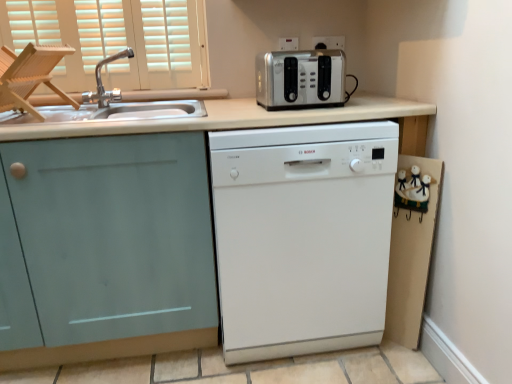
Question: Considering the relative positions of silver metallic outlet at upper center, which ranks as the 1th electric outlet in left-to-right order, and wooden folding chair at left in the image provided, is silver metallic outlet at upper center, which ranks as the 1th electric outlet in left-to-right order, to the right of wooden folding chair at left from the viewer's perspective?

Choices:
 (A) yes
 (B) no

Answer: (A)

Question: Can you confirm if silver metallic outlet at upper center, the second electric outlet in the right-to-left sequence, is thinner than wooden folding chair at left?

Choices:
 (A) yes
 (B) no

Answer: (A)

Question: Is silver metallic outlet at upper center, which ranks as the 1th electric outlet in left-to-right order, oriented towards wooden folding chair at left?

Choices:
 (A) no
 (B) yes

Answer: (A)

Question: Does silver metallic outlet at upper center, which ranks as the 1th electric outlet in left-to-right order, have a smaller size compared to wooden folding chair at left?

Choices:
 (A) no
 (B) yes

Answer: (B)

Question: Does silver metallic outlet at upper center, the second electric outlet in the right-to-left sequence, come in front of wooden folding chair at left?

Choices:
 (A) yes
 (B) no

Answer: (B)

Question: Does silver metallic outlet at upper center, which ranks as the 1th electric outlet in left-to-right order, have a greater width compared to wooden folding chair at left?

Choices:
 (A) no
 (B) yes

Answer: (A)

Question: Considering the relative sizes of brushed metal faucet at upper left and silver metallic outlet at upper center, which ranks as the 1th electric outlet in left-to-right order, in the image provided, is brushed metal faucet at upper left smaller than silver metallic outlet at upper center, which ranks as the 1th electric outlet in left-to-right order,?

Choices:
 (A) yes
 (B) no

Answer: (B)

Question: From the image's perspective, is brushed metal faucet at upper left located above silver metallic outlet at upper center, the second electric outlet in the right-to-left sequence?

Choices:
 (A) no
 (B) yes

Answer: (A)

Question: Does brushed metal faucet at upper left appear on the right side of silver metallic outlet at upper center, which ranks as the 1th electric outlet in left-to-right order?

Choices:
 (A) yes
 (B) no

Answer: (B)

Question: Is silver metallic outlet at upper center, which ranks as the 1th electric outlet in left-to-right order, at the back of brushed metal faucet at upper left?

Choices:
 (A) no
 (B) yes

Answer: (A)

Question: Is brushed metal faucet at upper left behind silver metallic outlet at upper center, the second electric outlet in the right-to-left sequence?

Choices:
 (A) no
 (B) yes

Answer: (A)

Question: Is brushed metal faucet at upper left facing towards silver metallic outlet at upper center, which ranks as the 1th electric outlet in left-to-right order?

Choices:
 (A) yes
 (B) no

Answer: (B)

Question: Is the depth of wooden folding chair at left less than that of metallic silver outlet at upper center, the first electric outlet positioned from the right?

Choices:
 (A) yes
 (B) no

Answer: (A)